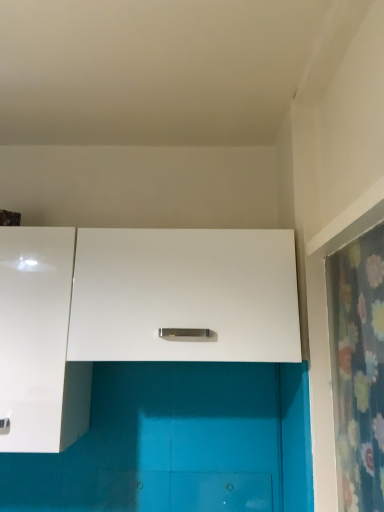
Question: From the image's perspective, is white matte cabinet at center, which appears as the first cabinetry when viewed from the right, on top of white glossy cabinet at left, placed as the first cabinetry when sorted from left to right?

Choices:
 (A) yes
 (B) no

Answer: (A)

Question: Is white matte cabinet at center, which appears as the first cabinetry when viewed from the right, oriented away from white glossy cabinet at left, placed as the first cabinetry when sorted from left to right?

Choices:
 (A) yes
 (B) no

Answer: (B)

Question: Is white matte cabinet at center, which appears as the first cabinetry when viewed from the right, at the left side of white glossy cabinet at left, placed as the first cabinetry when sorted from left to right?

Choices:
 (A) no
 (B) yes

Answer: (A)

Question: Is white glossy cabinet at left, the 2th cabinetry viewed from the right, located within white matte cabinet at center, the 2th cabinetry from the left?

Choices:
 (A) no
 (B) yes

Answer: (A)

Question: Is white matte cabinet at center, which appears as the first cabinetry when viewed from the right, positioned beyond the bounds of white glossy cabinet at left, the 2th cabinetry viewed from the right?

Choices:
 (A) yes
 (B) no

Answer: (A)

Question: From the image's perspective, does white matte cabinet at center, which appears as the first cabinetry when viewed from the right, appear lower than white glossy cabinet at left, placed as the first cabinetry when sorted from left to right?

Choices:
 (A) no
 (B) yes

Answer: (A)

Question: Can you confirm if white matte cabinet at center, the 2th cabinetry from the left, is thinner than floral fabric shower curtain at right?

Choices:
 (A) yes
 (B) no

Answer: (B)

Question: From the image's perspective, is white matte cabinet at center, which appears as the first cabinetry when viewed from the right, located above floral fabric shower curtain at right?

Choices:
 (A) no
 (B) yes

Answer: (B)

Question: Does white matte cabinet at center, the 2th cabinetry from the left, appear on the left side of floral fabric shower curtain at right?

Choices:
 (A) yes
 (B) no

Answer: (A)

Question: From a real-world perspective, is white matte cabinet at center, which appears as the first cabinetry when viewed from the right, under floral fabric shower curtain at right?

Choices:
 (A) yes
 (B) no

Answer: (B)

Question: From the image's perspective, is white matte cabinet at center, the 2th cabinetry from the left, beneath floral fabric shower curtain at right?

Choices:
 (A) yes
 (B) no

Answer: (B)

Question: Is white matte cabinet at center, the 2th cabinetry from the left, in front of floral fabric shower curtain at right?

Choices:
 (A) no
 (B) yes

Answer: (A)

Question: Can you confirm if white glossy cabinet at left, the 2th cabinetry viewed from the right, is smaller than floral fabric shower curtain at right?

Choices:
 (A) yes
 (B) no

Answer: (B)